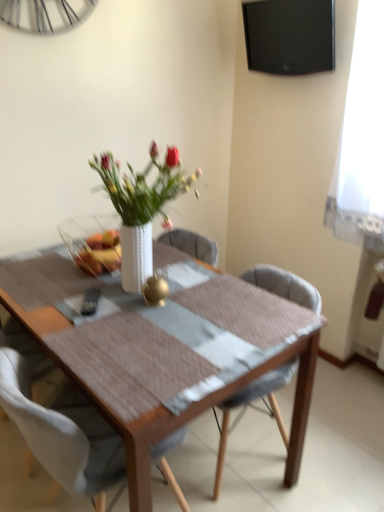
Question: From a real-world perspective, is light gray fabric chair at center, the 1th chair in the right-to-left sequence, on white fabric chair at center, arranged as the second chair when viewed from the right?

Choices:
 (A) yes
 (B) no

Answer: (B)

Question: Is light gray fabric chair at center, the 2th chair from the left, positioned with its back to white fabric chair at center, marked as the first chair in a left-to-right arrangement?

Choices:
 (A) no
 (B) yes

Answer: (A)

Question: From a real-world perspective, is light gray fabric chair at center, the 2th chair from the left, beneath white fabric chair at center, arranged as the second chair when viewed from the right?

Choices:
 (A) yes
 (B) no

Answer: (A)

Question: Does light gray fabric chair at center, the 1th chair in the right-to-left sequence, lie behind white fabric chair at center, marked as the first chair in a left-to-right arrangement?

Choices:
 (A) yes
 (B) no

Answer: (A)

Question: Considering the relative sizes of light gray fabric chair at center, the 1th chair in the right-to-left sequence, and white fabric chair at center, marked as the first chair in a left-to-right arrangement, in the image provided, is light gray fabric chair at center, the 1th chair in the right-to-left sequence, wider than white fabric chair at center, marked as the first chair in a left-to-right arrangement,?

Choices:
 (A) no
 (B) yes

Answer: (B)

Question: Considering the positions of light gray fabric chair at center, the 1th chair in the right-to-left sequence, and translucent glass bowl at center in the image, is light gray fabric chair at center, the 1th chair in the right-to-left sequence, bigger or smaller than translucent glass bowl at center?

Choices:
 (A) big
 (B) small

Answer: (A)

Question: In the image, is light gray fabric chair at center, the 2th chair from the left, positioned in front of or behind translucent glass bowl at center?

Choices:
 (A) front
 (B) behind

Answer: (A)

Question: In the image, is light gray fabric chair at center, the 2th chair from the left, on the left side or the right side of translucent glass bowl at center?

Choices:
 (A) right
 (B) left

Answer: (A)

Question: From the image's perspective, is light gray fabric chair at center, the 1th chair in the right-to-left sequence, above or below translucent glass bowl at center?

Choices:
 (A) above
 (B) below

Answer: (B)

Question: Would you say white fabric chair at center, arranged as the second chair when viewed from the right, is to the left or to the right of black glossy tv at upper right in the picture?

Choices:
 (A) right
 (B) left

Answer: (B)

Question: Is white fabric chair at center, marked as the first chair in a left-to-right arrangement, bigger or smaller than black glossy tv at upper right?

Choices:
 (A) big
 (B) small

Answer: (A)

Question: Is point (100, 441) positioned closer to the camera than point (266, 14)?

Choices:
 (A) closer
 (B) farther

Answer: (A)

Question: Do you think white fabric chair at center, arranged as the second chair when viewed from the right, is within black glossy tv at upper right, or outside of it?

Choices:
 (A) outside
 (B) inside

Answer: (A)

Question: Is wooden table at center spatially inside white fabric chair at center, marked as the first chair in a left-to-right arrangement, or outside of it?

Choices:
 (A) outside
 (B) inside

Answer: (A)

Question: In terms of height, does wooden table at center look taller or shorter compared to white fabric chair at center, marked as the first chair in a left-to-right arrangement?

Choices:
 (A) short
 (B) tall

Answer: (A)